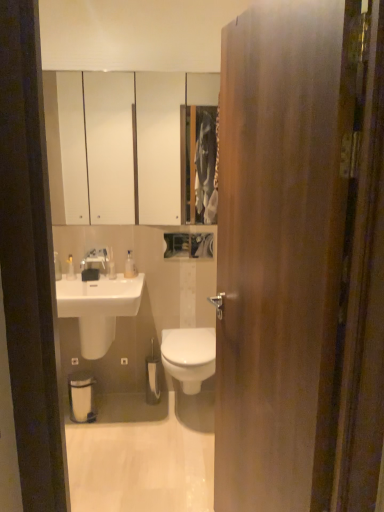
Question: Which direction should I rotate to look at white glossy medicine cabinet at upper center?

Choices:
 (A) left
 (B) right

Answer: (A)

Question: From the image's perspective, is clear plastic bottle at upper center, which is the 2th toiletry in left-to-right order, on top of white matte toilet paper at center?

Choices:
 (A) no
 (B) yes

Answer: (B)

Question: Is clear plastic bottle at upper center, marked as the 1th toiletry in a right-to-left arrangement, to the left of white matte toilet paper at center from the viewer's perspective?

Choices:
 (A) no
 (B) yes

Answer: (B)

Question: Can you confirm if clear plastic bottle at upper center, marked as the 1th toiletry in a right-to-left arrangement, is bigger than white matte toilet paper at center?

Choices:
 (A) no
 (B) yes

Answer: (A)

Question: Considering the relative sizes of clear plastic bottle at upper center, which is the 2th toiletry in left-to-right order, and white matte toilet paper at center in the image provided, is clear plastic bottle at upper center, which is the 2th toiletry in left-to-right order, wider than white matte toilet paper at center?

Choices:
 (A) yes
 (B) no

Answer: (B)

Question: Considering the relative sizes of clear plastic bottle at upper center, which is the 2th toiletry in left-to-right order, and white matte toilet paper at center in the image provided, is clear plastic bottle at upper center, which is the 2th toiletry in left-to-right order, smaller than white matte toilet paper at center?

Choices:
 (A) yes
 (B) no

Answer: (A)

Question: Does clear plastic bottle at upper center, marked as the 1th toiletry in a right-to-left arrangement, have a greater height compared to white matte toilet paper at center?

Choices:
 (A) no
 (B) yes

Answer: (A)

Question: Is clear plastic bottle at upper center, marked as the 1th toiletry in a right-to-left arrangement, to the left of satin nickel faucet at upper center from the viewer's perspective?

Choices:
 (A) yes
 (B) no

Answer: (B)

Question: Can you confirm if clear plastic bottle at upper center, marked as the 1th toiletry in a right-to-left arrangement, is positioned to the right of satin nickel faucet at upper center?

Choices:
 (A) no
 (B) yes

Answer: (B)

Question: Is clear plastic bottle at upper center, marked as the 1th toiletry in a right-to-left arrangement, thinner than satin nickel faucet at upper center?

Choices:
 (A) no
 (B) yes

Answer: (B)

Question: Is satin nickel faucet at upper center located within clear plastic bottle at upper center, marked as the 1th toiletry in a right-to-left arrangement?

Choices:
 (A) no
 (B) yes

Answer: (A)

Question: Can you confirm if clear plastic bottle at upper center, marked as the 1th toiletry in a right-to-left arrangement, is smaller than satin nickel faucet at upper center?

Choices:
 (A) no
 (B) yes

Answer: (B)

Question: Is the position of clear plastic bottle at upper center, which is the 2th toiletry in left-to-right order, less distant than that of satin nickel faucet at upper center?

Choices:
 (A) no
 (B) yes

Answer: (A)

Question: Does white glossy floor at center have a lesser width compared to satin nickel faucet at upper center?

Choices:
 (A) no
 (B) yes

Answer: (A)